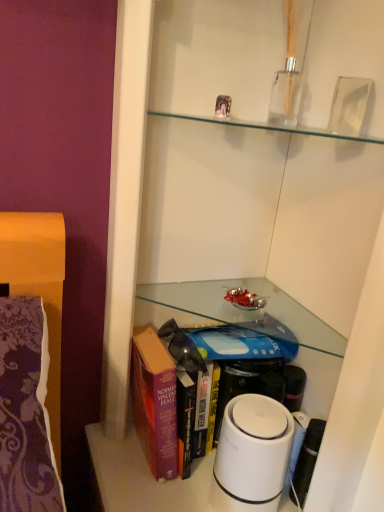
Question: Is purple hardcover book at lower center to the left or to the right of white plastic humidifier at lower center in the image?

Choices:
 (A) left
 (B) right

Answer: (A)

Question: From the image's perspective, relative to white plastic humidifier at lower center, is purple hardcover book at lower center above or below?

Choices:
 (A) above
 (B) below

Answer: (A)

Question: Is point (188, 436) positioned closer to the camera than point (289, 435)?

Choices:
 (A) closer
 (B) farther

Answer: (B)

Question: From a real-world perspective, is white plastic humidifier at lower center positioned above or below purple hardcover book at lower center?

Choices:
 (A) above
 (B) below

Answer: (B)

Question: Does point (259, 493) appear closer or farther from the camera than point (193, 422)?

Choices:
 (A) closer
 (B) farther

Answer: (A)

Question: In terms of size, does white plastic humidifier at lower center appear bigger or smaller than purple hardcover book at lower center?

Choices:
 (A) small
 (B) big

Answer: (A)

Question: Is white plastic humidifier at lower center spatially inside purple hardcover book at lower center, or outside of it?

Choices:
 (A) inside
 (B) outside

Answer: (A)